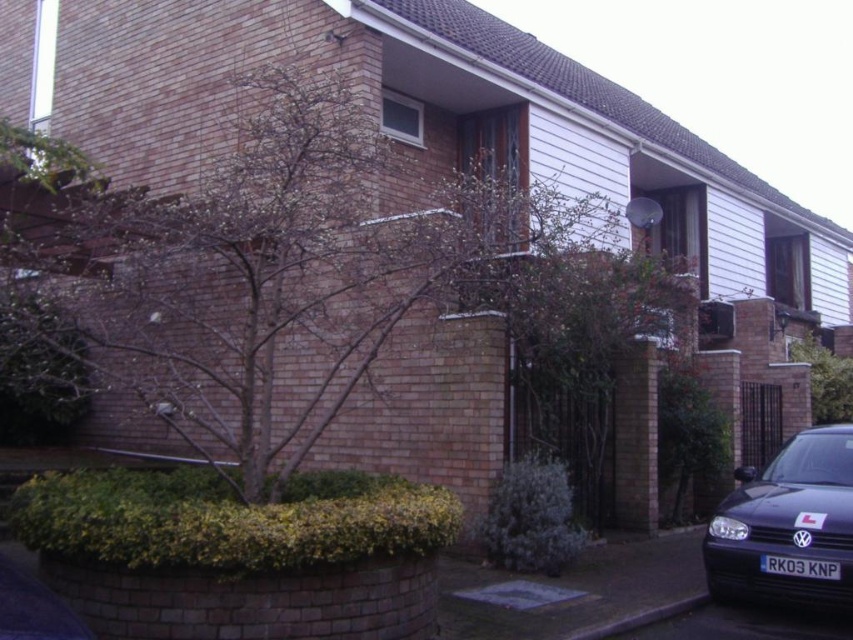
You are a delivery person trying to park a matte black car at lower right in a driveway next to a black plastic license plate at lower right. Can you park the car without overlapping the license plate?

The matte black car at lower right is larger in size than the black plastic license plate at lower right, so there is enough space to park the car without overlapping the license plate.

You are standing at the front gate of the house and want to park your car behind the green leafy tree at center so it won t be visible from the street. Is the matte black car at lower right currently blocking your parking spot?

The matte black car at lower right is closer to the viewer than the green leafy tree at center, so if you want to park behind the green leafy tree at center, the matte black car at lower right is in the way and would block the parking spot.

You are a delivery person trying to find the correct address. You see a green leafy tree at center and a black plastic license plate at lower right. Which object is taller?

The green leafy tree at center is taller than the black plastic license plate at lower right.